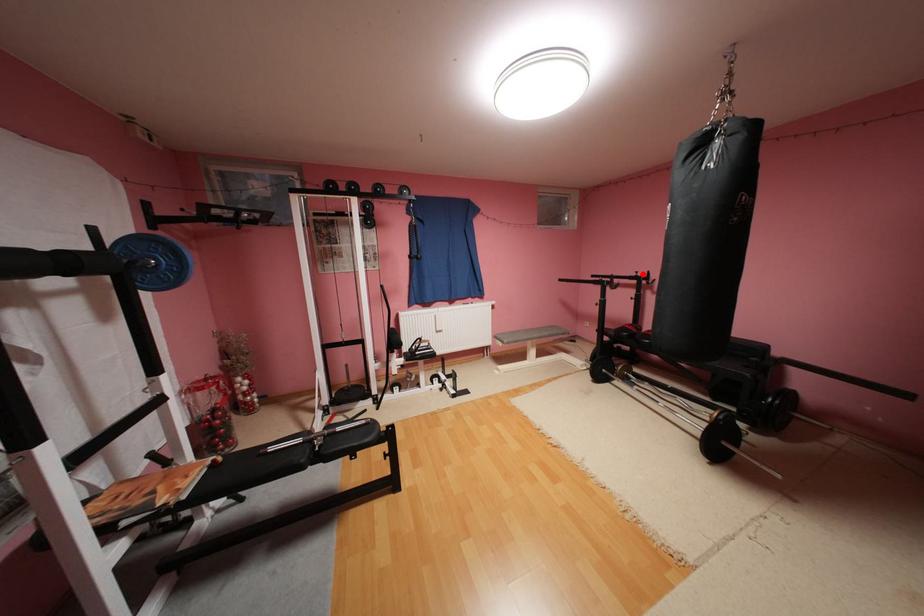
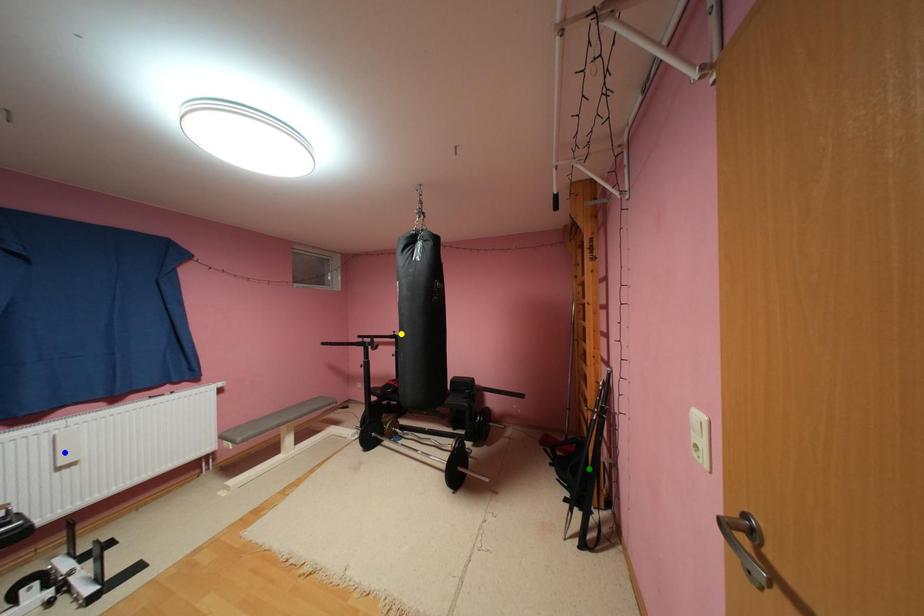
Question: I am providing you with two images of the same scene from different viewpoints. A red point is marked on the first image. You are given multiple points on the second image. Can you choose the point in image 2 that corresponds to the point in image 1?

Choices:
 (A) yellow point
 (B) green point
 (C) blue point

Answer: (A)